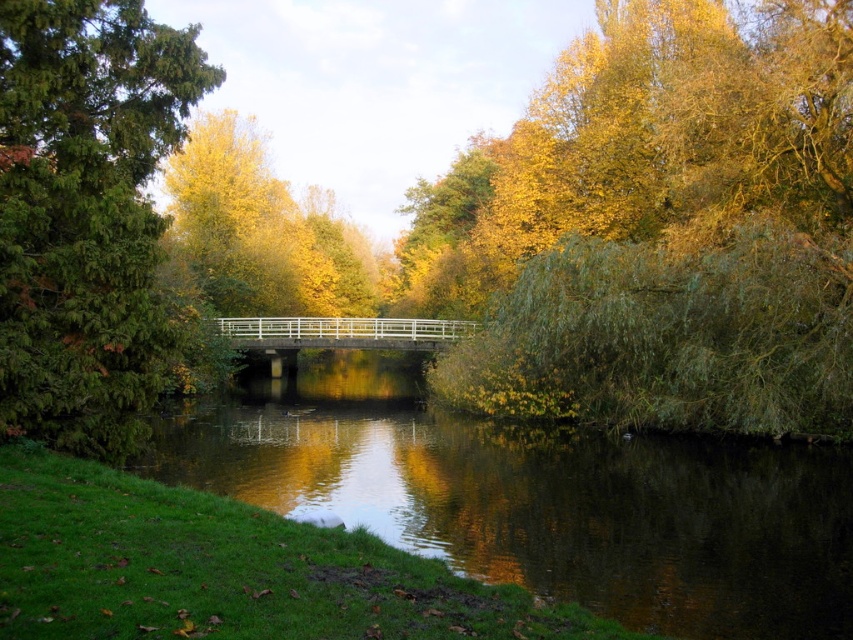
Question: Can you confirm if golden textured leaves at right is bigger than green reflective water at center?

Choices:
 (A) no
 (B) yes

Answer: (B)

Question: Which of these objects is positioned closest to the green reflective water at center?

Choices:
 (A) golden textured leaves at right
 (B) green coniferous tree at left

Answer: (B)

Question: Is golden textured leaves at right wider than green coniferous tree at left?

Choices:
 (A) yes
 (B) no

Answer: (A)

Question: Is green reflective water at center wider than green coniferous tree at left?

Choices:
 (A) no
 (B) yes

Answer: (B)

Question: Which is nearer to the green coniferous tree at left?

Choices:
 (A) green reflective water at center
 (B) golden textured leaves at right

Answer: (A)

Question: Which object is farther from the camera taking this photo?

Choices:
 (A) green coniferous tree at left
 (B) green reflective water at center
 (C) golden textured leaves at right

Answer: (C)